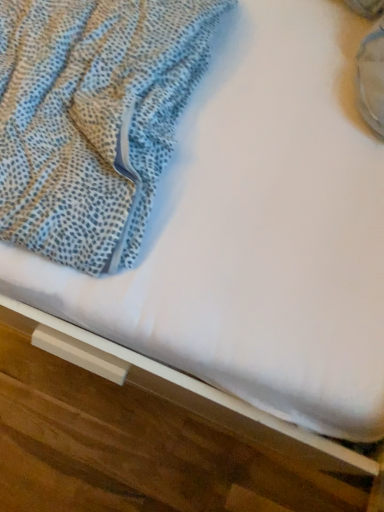
Describe the element at coordinates (92, 119) in the screenshot. The image size is (384, 512). I see `blue dotted fabric at upper left` at that location.

This screenshot has height=512, width=384. What are the coordinates of `blue dotted fabric at upper left` in the screenshot? It's located at (92, 119).

At what (x,y) coordinates should I click in order to perform the action: click on blue dotted fabric at upper left. Please return your answer as a coordinate pair (x, y). Looking at the image, I should click on (92, 119).